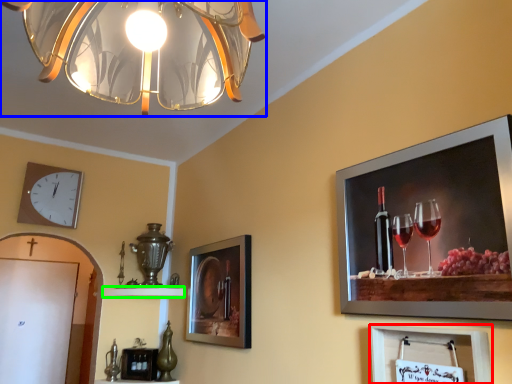
Question: Estimate the real-world distances between objects in this image. Which object is closer to picture frame (highlighted by a red box), lamp (highlighted by a blue box) or shelf (highlighted by a green box)?

Choices:
 (A) lamp
 (B) shelf

Answer: (A)